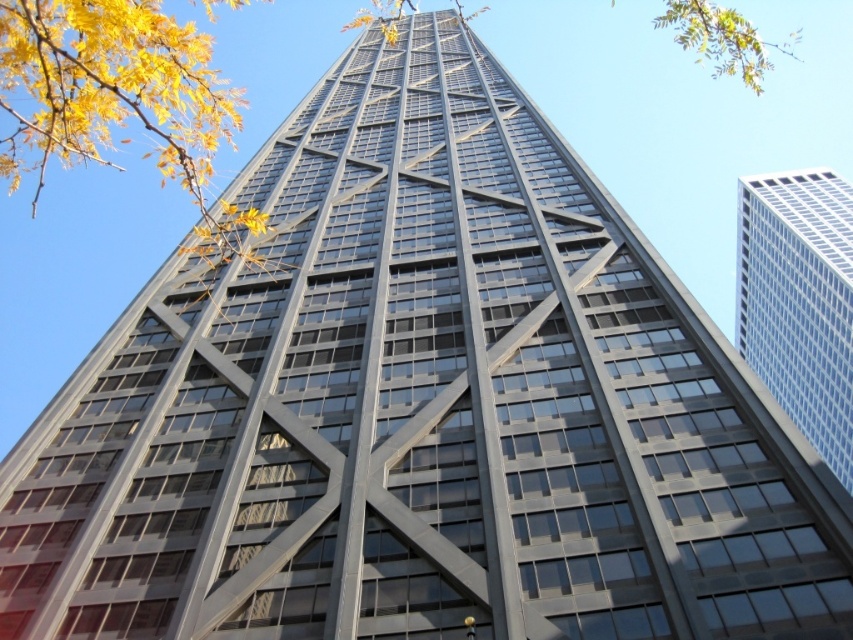
In the scene shown: You are standing in front of the white glass building at right and looking towards the yellow leaves at upper left. Which object is nearer to you?

The yellow leaves at upper left are closer to you than the white glass building at right.